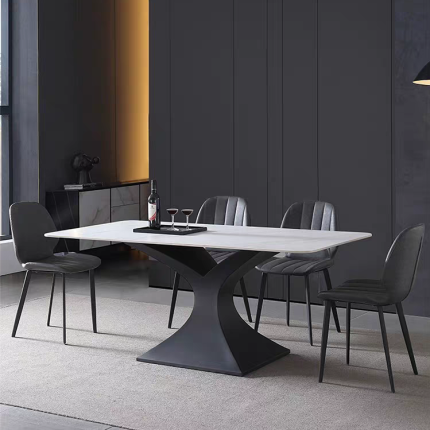
The width and height of the screenshot is (430, 430). I want to click on wall, so click(x=345, y=106), click(x=79, y=72).